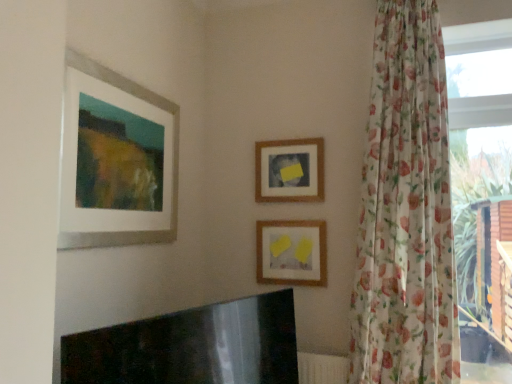
Question: Is transparent floral curtain at right turned away from matte white picture frame at upper left, the 3th picture frame viewed from the back?

Choices:
 (A) no
 (B) yes

Answer: (A)

Question: Is transparent floral curtain at right oriented towards matte white picture frame at upper left, the first picture frame from the left?

Choices:
 (A) no
 (B) yes

Answer: (A)

Question: From a real-world perspective, is transparent floral curtain at right below matte white picture frame at upper left, which appears as the third picture frame when viewed from the right?

Choices:
 (A) yes
 (B) no

Answer: (A)

Question: Is transparent floral curtain at right closer to camera compared to matte white picture frame at upper left, the first picture frame from the left?

Choices:
 (A) yes
 (B) no

Answer: (B)

Question: From a real-world perspective, does transparent floral curtain at right stand above matte white picture frame at upper left, which appears as the third picture frame when viewed from the right?

Choices:
 (A) no
 (B) yes

Answer: (A)

Question: Is transparent floral curtain at right shorter than matte white picture frame at upper left, the first picture frame from the left?

Choices:
 (A) no
 (B) yes

Answer: (A)

Question: Is floral sheer curtain at right behind wooden frame at center, arranged as the third picture frame when viewed from the front?

Choices:
 (A) yes
 (B) no

Answer: (B)

Question: Is floral sheer curtain at right thinner than wooden frame at center, which appears as the 2th picture frame when viewed from the left?

Choices:
 (A) no
 (B) yes

Answer: (A)

Question: Is floral sheer curtain at right at the left side of wooden frame at center, arranged as the third picture frame when viewed from the front?

Choices:
 (A) no
 (B) yes

Answer: (A)

Question: From a real-world perspective, is floral sheer curtain at right on top of wooden frame at center, which appears as the 2th picture frame when viewed from the left?

Choices:
 (A) yes
 (B) no

Answer: (B)

Question: From the image's perspective, is floral sheer curtain at right above wooden frame at center, the second picture frame from the right?

Choices:
 (A) no
 (B) yes

Answer: (A)

Question: Is floral sheer curtain at right smaller than wooden frame at center, which appears as the 2th picture frame when viewed from the left?

Choices:
 (A) no
 (B) yes

Answer: (A)

Question: Is transparent floral curtain at right located within floral sheer curtain at right?

Choices:
 (A) yes
 (B) no

Answer: (B)